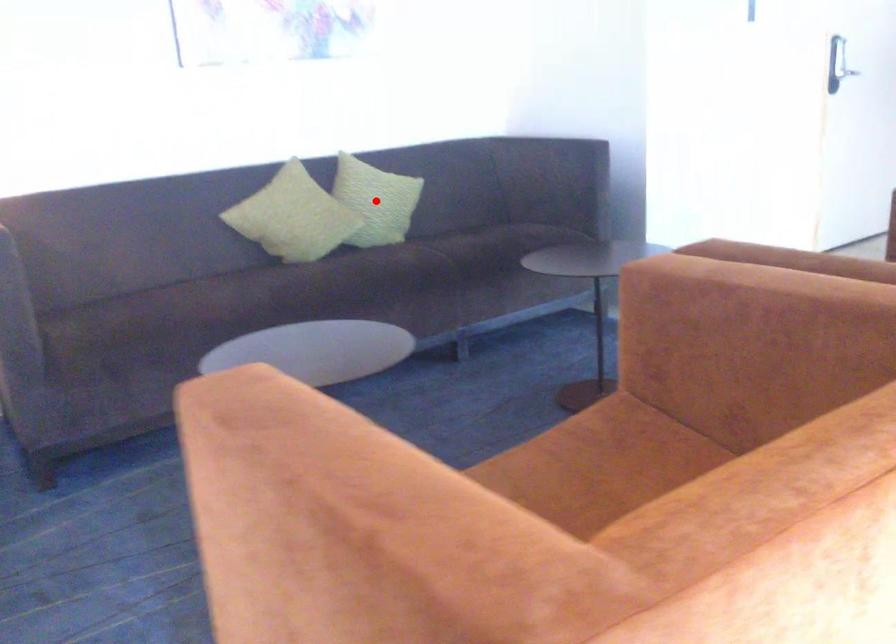
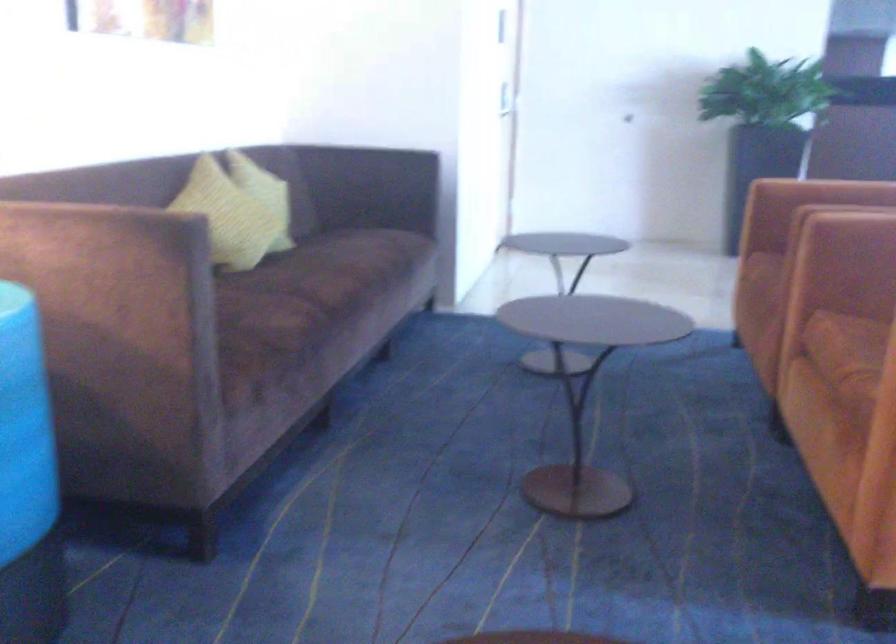
Question: I am providing you with two images of the same scene from different viewpoints. A red point is marked on the first image. Is the red point's position out of view in image 2?

Choices:
 (A) Yes
 (B) No

Answer: (A)